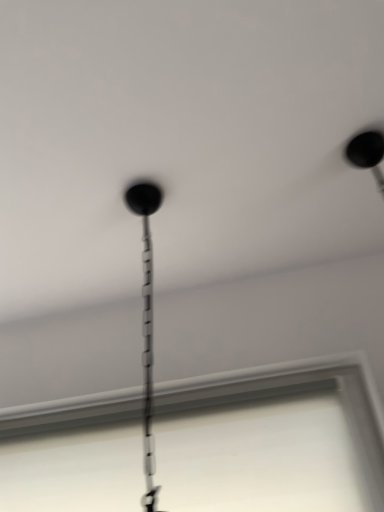
Measure the distance between point (208, 380) and camera.

The distance of point (208, 380) from camera is 1.38 meters.

At what (x,y) coordinates should I click in order to perform the action: click on transparent plastic window screen at lower center. Please return your answer as a coordinate pair (x, y). The image size is (384, 512). Looking at the image, I should click on (272, 439).

The image size is (384, 512). Describe the element at coordinates (272, 439) in the screenshot. I see `transparent plastic window screen at lower center` at that location.

Locate an element on the screen. This screenshot has height=512, width=384. transparent plastic window screen at lower center is located at coordinates (272, 439).